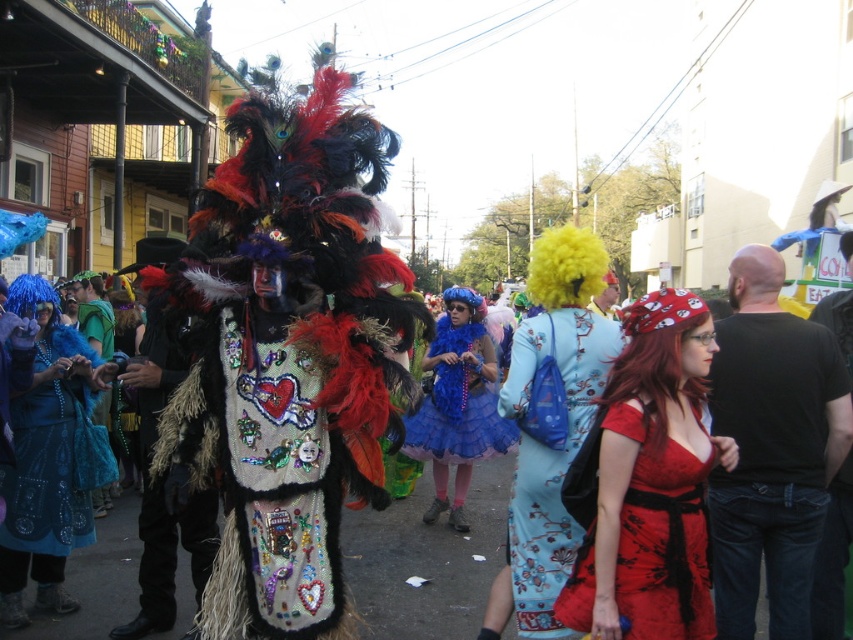
Can you confirm if red synthetic wig at center is positioned below shiny blue fabric at left?

Correct, red synthetic wig at center is located below shiny blue fabric at left.

Is red synthetic wig at center in front of shiny blue fabric at left?

Yes, red synthetic wig at center is in front of shiny blue fabric at left.

Is point (645, 451) farther from camera compared to point (91, 314)?

No, it is not.

This screenshot has height=640, width=853. Find the location of `red synthetic wig at center`. red synthetic wig at center is located at coordinates 653,378.

Between point (38, 324) and point (519, 595), which one is positioned in front?

Point (519, 595) is more forward.

Who is more distant from viewer, (70, 609) or (554, 317)?

Point (70, 609)

At what (x,y) coordinates should I click in order to perform the action: click on shiny blue fabric dress at left. Please return your answer as a coordinate pair (x, y). Looking at the image, I should click on (49, 460).

Can you confirm if black cotton shirt at right is thinner than yellow fuzzy wig at upper right?

Yes, black cotton shirt at right is thinner than yellow fuzzy wig at upper right.

Does point (816, 340) lie in front of point (616, 317)?

Yes, it is in front of point (616, 317).

Describe the element at coordinates (770, 449) in the screenshot. I see `black cotton shirt at right` at that location.

You are a GUI agent. You are given a task and a screenshot of the screen. Output one action in this format:
    pyautogui.click(x=<x>, y=<y>)
    Task: Click on the black cotton shirt at right
    
    Given the screenshot: What is the action you would take?
    pyautogui.click(x=770, y=449)